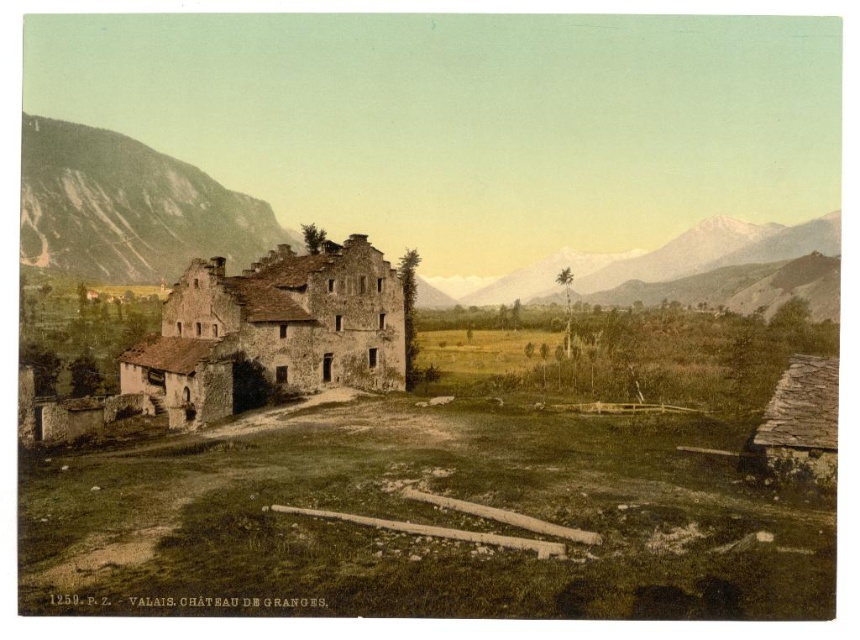
Question: Which point is closer to the camera taking this photo?

Choices:
 (A) (564, 262)
 (B) (91, 179)

Answer: (B)

Question: Is rustic stone mountain at left positioned at the back of snowy granite mountain at upper right?

Choices:
 (A) no
 (B) yes

Answer: (A)

Question: From the image, what is the correct spatial relationship of rustic stone mountain at left in relation to snowy granite mountain at upper right?

Choices:
 (A) above
 (B) below

Answer: (A)

Question: Can you confirm if rustic stone mountain at left is positioned to the left of snowy granite mountain at upper right?

Choices:
 (A) no
 (B) yes

Answer: (B)

Question: Among these objects, which one is nearest to the camera?

Choices:
 (A) rustic stone mountain at left
 (B) snowy granite mountain at upper right

Answer: (A)